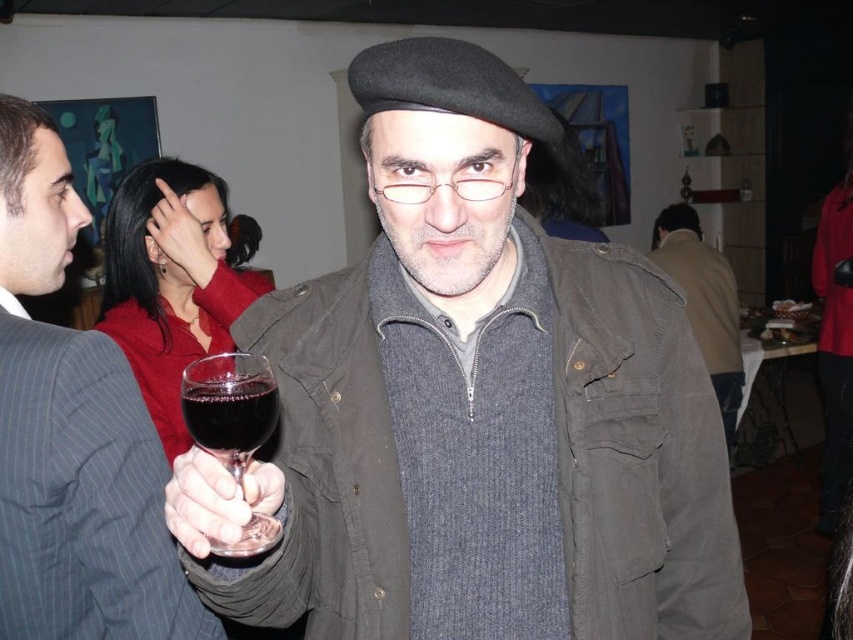
You are at a party and want to pour a drink into the glass holding the dark red liquid at center. Where should you aim the pour relative to the glass?

The dark red liquid at center is located at point (229, 410), so aim the pour at that coordinate.